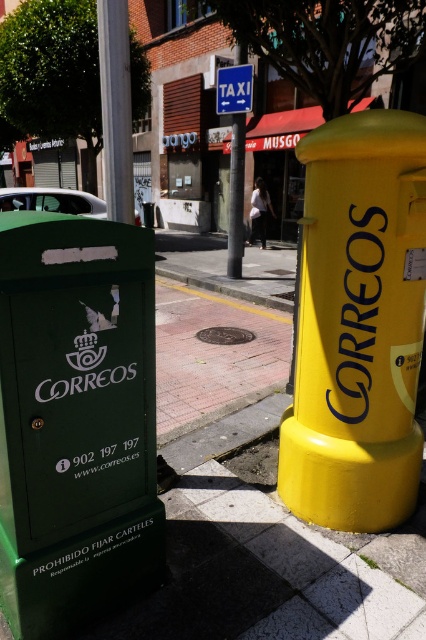
Between point (396, 179) and point (129, 136), which one is positioned behind?

The point (129, 136) is more distant.

Is yellow matte post at right in front of smooth white post at center?

Yes, it is in front of smooth white post at center.

Who is more forward, (x=382, y=288) or (x=103, y=24)?

Point (x=382, y=288) is more forward.

At what (x,y) coordinates should I click in order to perform the action: click on yellow matte post at right. Please return your answer as a coordinate pair (x, y). This screenshot has width=426, height=640. Looking at the image, I should click on (357, 324).

Consider the image. Can you confirm if smooth white post at center is positioned above matte white car at upper left?

No.

The width and height of the screenshot is (426, 640). I want to click on smooth white post at center, so tap(115, 108).

Can you confirm if yellow matte post at right is positioned below blue plastic taxi sign at upper center?

Correct, yellow matte post at right is located below blue plastic taxi sign at upper center.

Does point (374, 193) come farther from viewer compared to point (230, 84)?

No, it is not.

I want to click on yellow matte post at right, so pos(357,324).